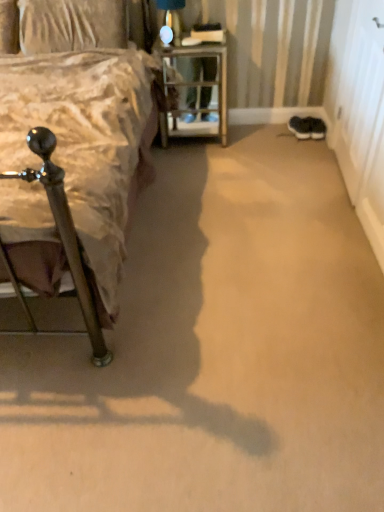
Find the location of a particular element. Image resolution: width=384 pixels, height=512 pixels. vacant area on top of metal/textured nightstand at center (from a real-world perspective) is located at coordinates (202, 36).